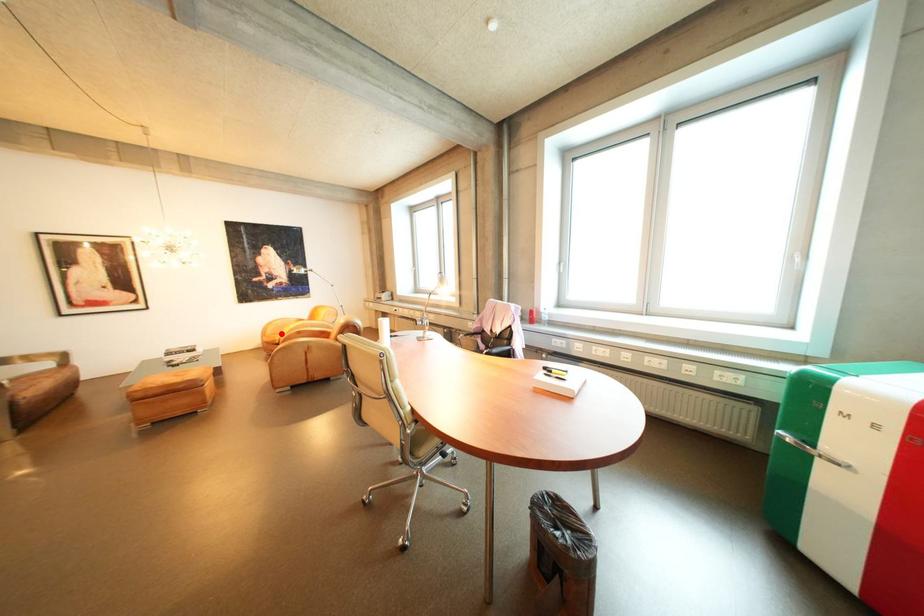
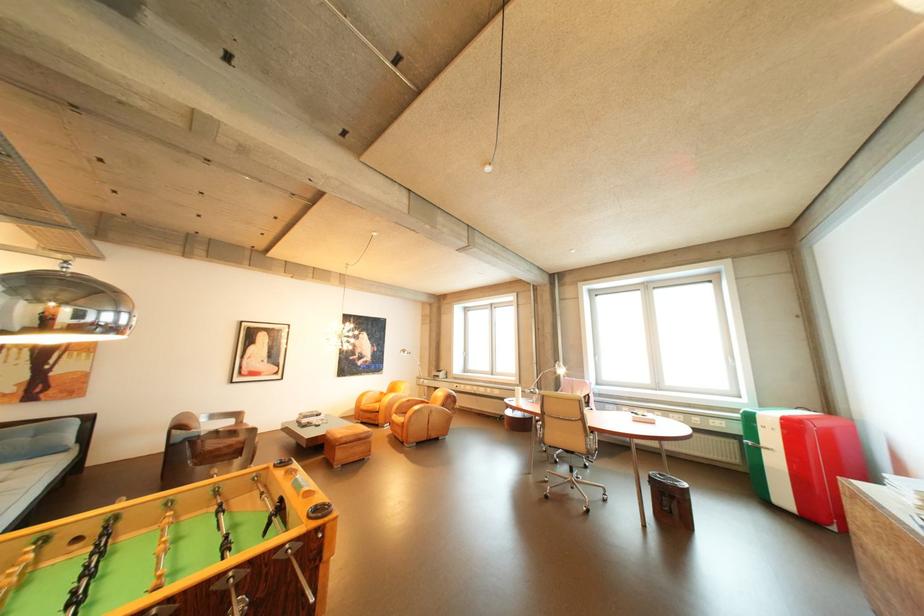
Question: A red point is marked in image1. In image2, is the corresponding 3D point closer to the camera or farther? Reply with the corresponding letter.

Choices:
 (A) The corresponding 3D point is closer.
 (B) The corresponding 3D point is farther.

Answer: (B)